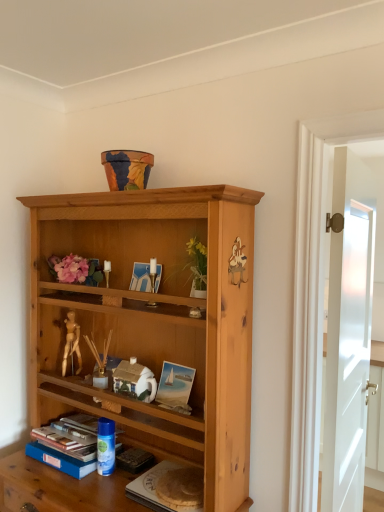
The height and width of the screenshot is (512, 384). Find the location of `empty space that is ontop of blue hardcover book at lower left (from a real-world perspective)`. empty space that is ontop of blue hardcover book at lower left (from a real-world perspective) is located at coordinates (79, 423).